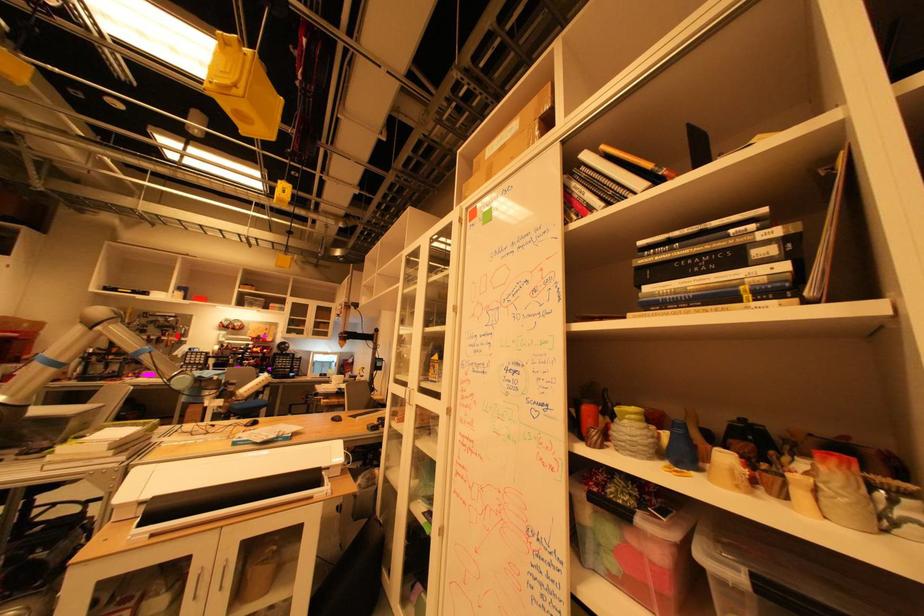
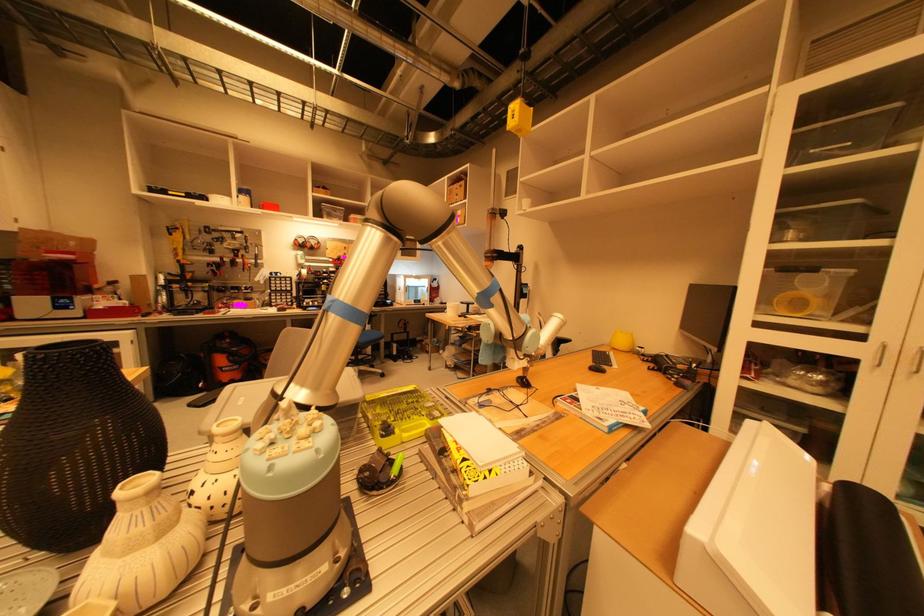
The point at the highlighted location is marked in the first image. Where is the corresponding point in the second image?

(249, 257)